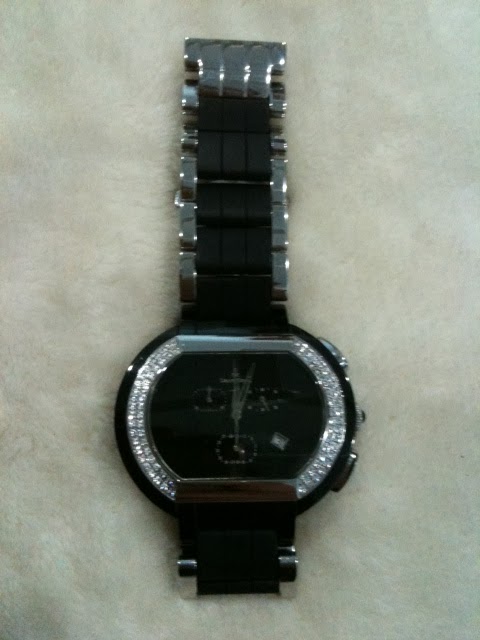
Find the location of a particular element. This screenshot has height=640, width=480. fabric surface is located at coordinates (374, 287).